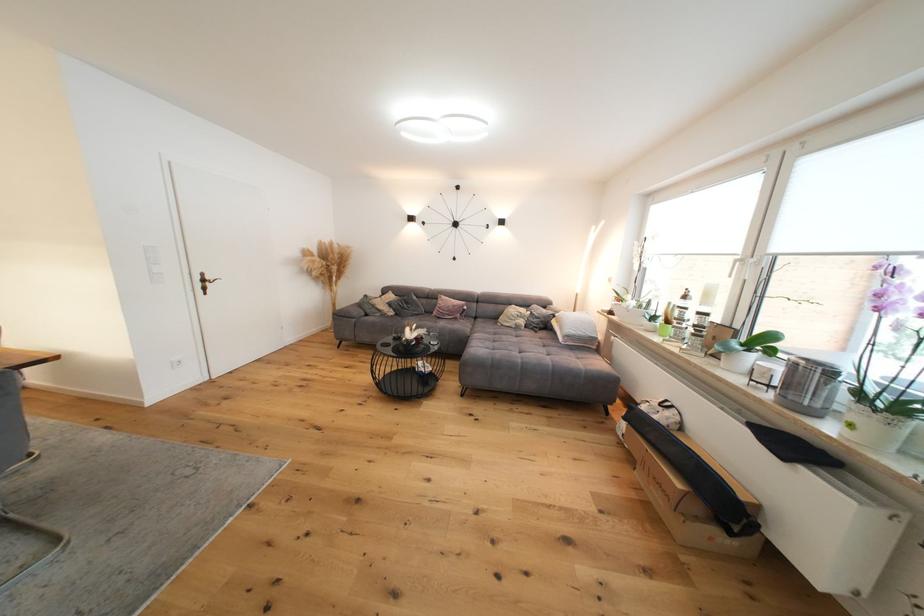
Where is `white flower pot`? white flower pot is located at coordinates (873, 427).